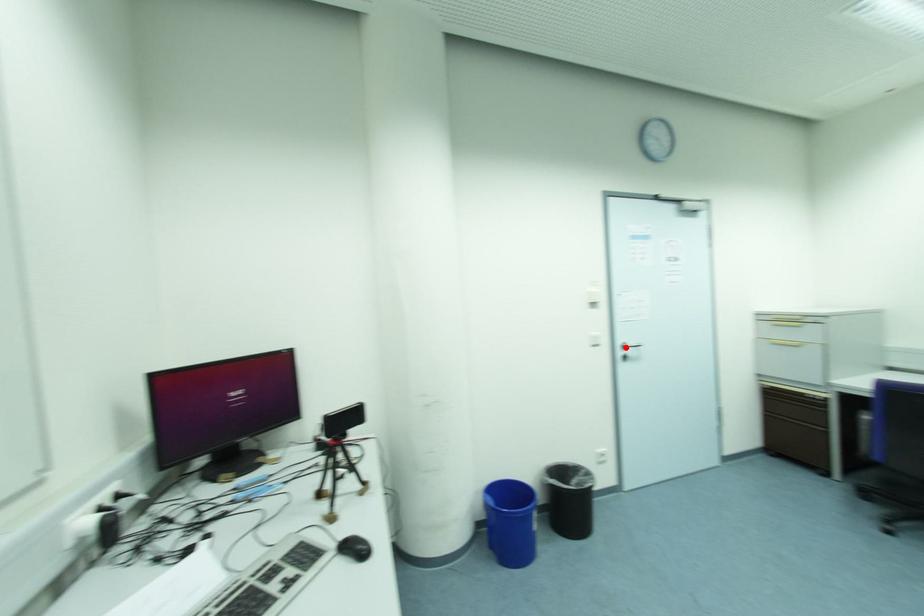
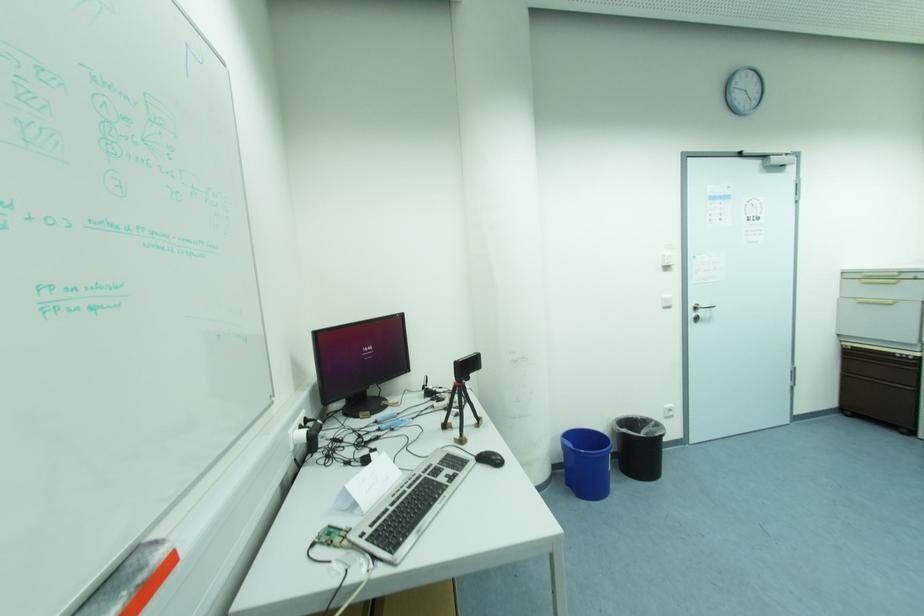
Find the pixel in the second image that matches the highlighted location in the first image.

(697, 309)